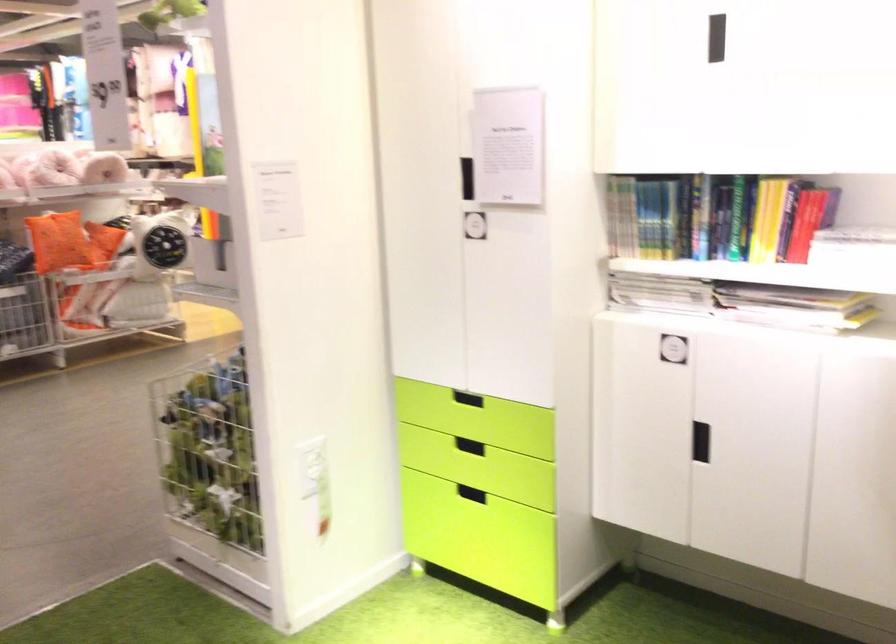
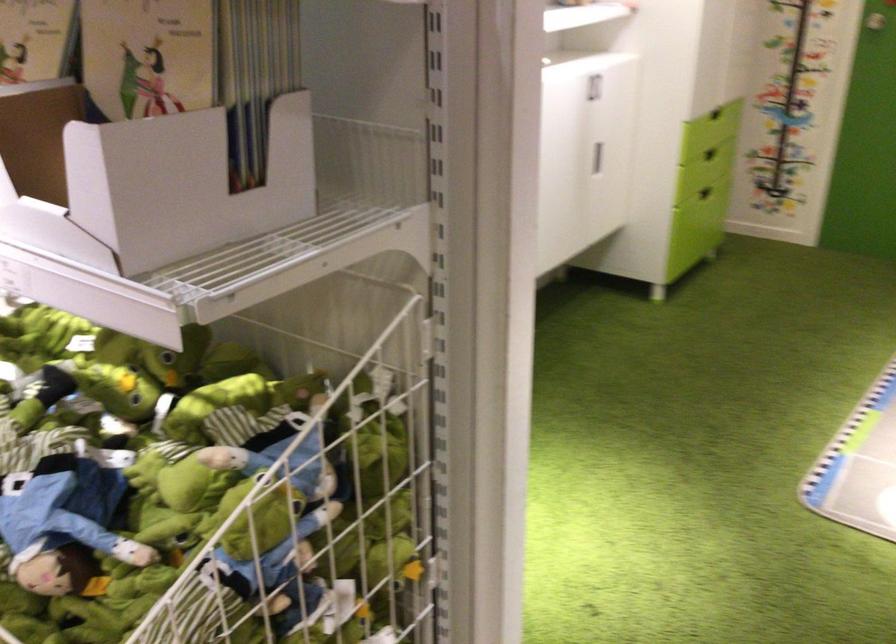
Question: I am providing you with two images of the same scene from different viewpoints. Which of the following objects are not visible in image2?

Choices:
 (A) green drawer handle
 (B) recessed black handle
 (C) light blue pouch
 (D) stuffed frog toy

Answer: (B)